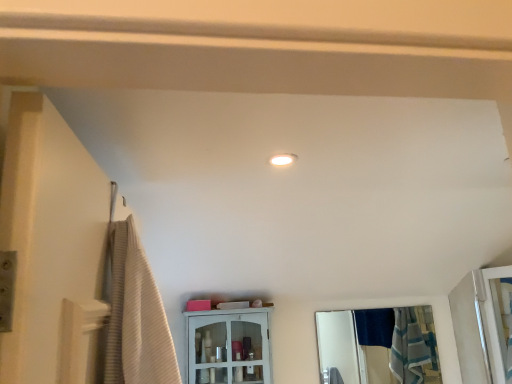
The image size is (512, 384). In order to click on clear glass screen door at right in this screenshot , I will do `click(477, 326)`.

This screenshot has height=384, width=512. What are the coordinates of `clear glass mirror at center` in the screenshot? It's located at (378, 346).

Is clear glass screen door at right wider or thinner than clear glass mirror at center?

Considering their sizes, clear glass screen door at right looks broader than clear glass mirror at center.

Is clear glass screen door at right aimed at clear glass mirror at center?

No, clear glass screen door at right is not facing towards clear glass mirror at center.

Considering the points (476, 272) and (387, 309), which point is in front, point (476, 272) or point (387, 309)?

Point (476, 272)

How many degrees apart are the facing directions of white glossy cabinet at center and clear glass mirror at center?

The facing directions of white glossy cabinet at center and clear glass mirror at center are 0.768 degrees apart.

Image resolution: width=512 pixels, height=384 pixels. Find the location of `cabinetry on the left of clear glass mirror at center`. cabinetry on the left of clear glass mirror at center is located at coordinates (229, 346).

From a real-world perspective, which object stands above the other?

white glossy cabinet at center is physically above.

Based on the photo, relative to clear glass mirror at center, is white glossy cabinet at center in front or behind?

Clearly, white glossy cabinet at center is in front of clear glass mirror at center.

In terms of width, does clear glass mirror at center look wider or thinner when compared to white glossy cabinet at center?

In the image, clear glass mirror at center appears to be more narrow than white glossy cabinet at center.

Where is `mirror on the right of white glossy cabinet at center`? This screenshot has height=384, width=512. mirror on the right of white glossy cabinet at center is located at coordinates (378, 346).

Does point (430, 366) appear closer or farther from the camera than point (267, 310)?

Clearly, point (430, 366) is more distant from the camera than point (267, 310).

Who is taller, clear glass screen door at right or white glossy cabinet at center?

Standing taller between the two is clear glass screen door at right.

Is clear glass screen door at right far from white glossy cabinet at center?

clear glass screen door at right is positioned a significant distance from white glossy cabinet at center.

Looking at this image, between clear glass screen door at right and white glossy cabinet at center, which one appears on the right side from the viewer's perspective?

From the viewer's perspective, clear glass screen door at right appears more on the right side.

Which is correct: clear glass mirror at center is inside clear glass screen door at right, or outside of it?

clear glass mirror at center is located beyond the bounds of clear glass screen door at right.

From the image's perspective, is clear glass mirror at center on clear glass screen door at right?

Incorrect, from the image's perspective, clear glass mirror at center is lower than clear glass screen door at right.

Considering the positions of objects clear glass mirror at center and clear glass screen door at right in the image provided, who is in front, clear glass mirror at center or clear glass screen door at right?

Positioned in front is clear glass screen door at right.

Looking at this image, is clear glass mirror at center oriented away from clear glass screen door at right?

No.

From a real-world perspective, is white glossy cabinet at center beneath clear glass screen door at right?

No, from a real-world perspective, white glossy cabinet at center is not beneath clear glass screen door at right.

Considering the relative positions of white glossy cabinet at center and clear glass screen door at right in the image provided, is white glossy cabinet at center in front of clear glass screen door at right?

No, it is not.

Which is more to the right, white glossy cabinet at center or clear glass screen door at right?

clear glass screen door at right.

Is white glossy cabinet at center positioned with its back to clear glass screen door at right?

That's not correct — white glossy cabinet at center is not looking away from clear glass screen door at right.

Locate an element on the screen. Image resolution: width=512 pixels, height=384 pixels. mirror below the clear glass screen door at right (from a real-world perspective) is located at coordinates (378, 346).

You are a GUI agent. You are given a task and a screenshot of the screen. Output one action in this format:
    pyautogui.click(x=<x>, y=<y>)
    Task: Click on the mirror located on the right of white glossy cabinet at center
    This screenshot has height=384, width=512.
    Given the screenshot: What is the action you would take?
    pyautogui.click(x=378, y=346)

Looking at the image, which one is located further to white glossy cabinet at center, clear glass mirror at center or clear glass screen door at right?

clear glass mirror at center lies further to white glossy cabinet at center than the other object.

Which object lies further to the anchor point clear glass screen door at right, clear glass mirror at center or white glossy cabinet at center?

The object further to clear glass screen door at right is white glossy cabinet at center.

Estimate the real-world distances between objects in this image. Which object is closer to white glossy cabinet at center, clear glass screen door at right or clear glass mirror at center?

clear glass screen door at right.

Considering their positions, is white glossy cabinet at center positioned closer to clear glass mirror at center than clear glass screen door at right?

Among the two, clear glass screen door at right is located nearer to clear glass mirror at center.

Considering their positions, is clear glass screen door at right positioned further to clear glass mirror at center than white glossy cabinet at center?

The object further to clear glass mirror at center is white glossy cabinet at center.

Considering their positions, is white glossy cabinet at center positioned further to clear glass screen door at right than clear glass mirror at center?

white glossy cabinet at center is positioned further to the anchor clear glass screen door at right.

This screenshot has width=512, height=384. I want to click on mirror between white glossy cabinet at center and clear glass screen door at right, so click(x=378, y=346).